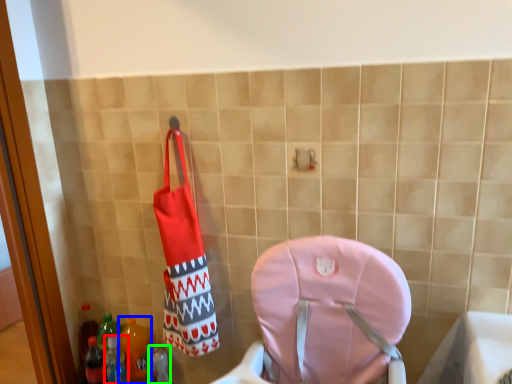
Question: Based on their relative distances, which object is nearer to bottle (highlighted by a red box)? Choose from bottle (highlighted by a blue box) and bottle (highlighted by a green box).

Choices:
 (A) bottle
 (B) bottle

Answer: (A)